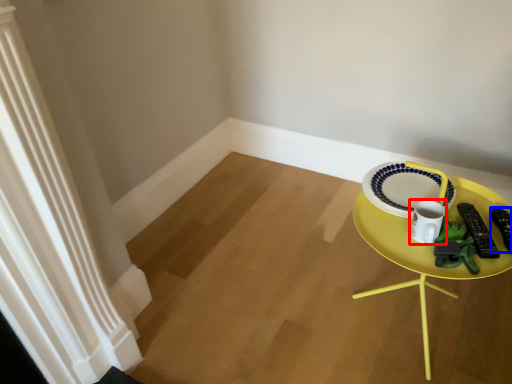
Question: Which point is further to the camera, coffee cup (highlighted by a red box) or remote control (highlighted by a blue box)?

Choices:
 (A) coffee cup
 (B) remote control

Answer: (B)